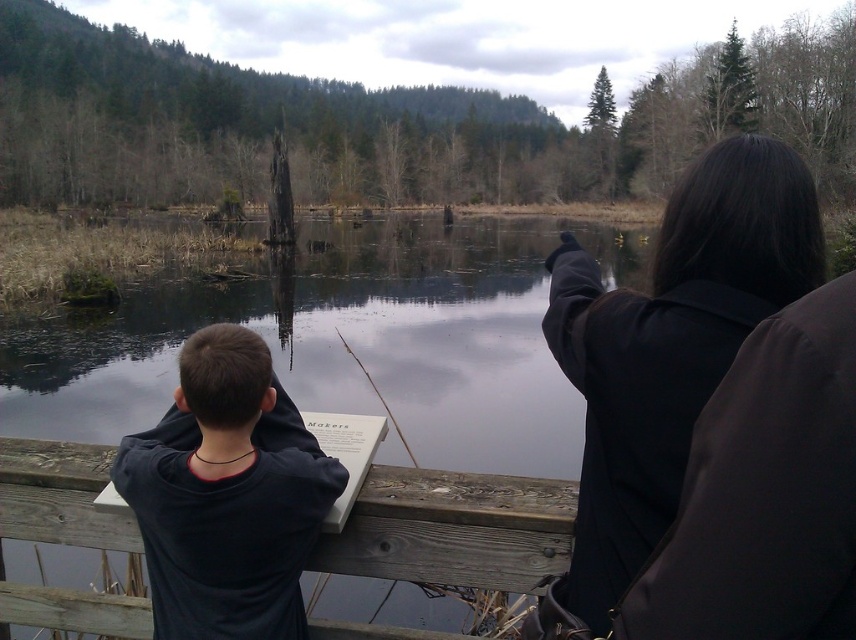
Question: Is black matte coat at upper right wider than wooden sign at lower left?

Choices:
 (A) no
 (B) yes

Answer: (B)

Question: Does black matte coat at upper right appear over wooden sign at lower left?

Choices:
 (A) yes
 (B) no

Answer: (A)

Question: Among these points, which one is nearest to the camera?

Choices:
 (A) (351, 556)
 (B) (211, 372)

Answer: (B)

Question: Is black matte coat at upper right closer to camera compared to dark blue shirt at center?

Choices:
 (A) no
 (B) yes

Answer: (B)

Question: Which object appears closest to the camera in this image?

Choices:
 (A) wooden sign at lower left
 (B) black matte coat at upper right
 (C) dark blue shirt at center

Answer: (B)

Question: Which object is the closest to the wooden sign at lower left?

Choices:
 (A) dark blue shirt at center
 (B) black matte coat at upper right

Answer: (A)